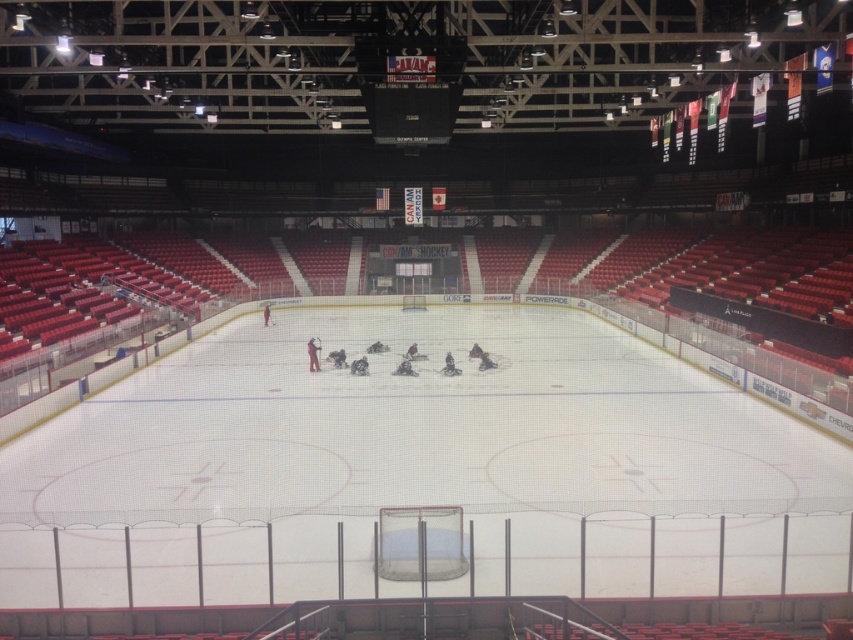
You are standing at the edge of the indoor ice hockey rink and want to move towards the two points marked on the ice. The first point is labeled as point (310, 369) and the second is point (396, 368). Which point should you head towards if you want to reach the one that is closer to you first?

You should head towards point (310, 369) because it is closer to the viewer than point (396, 368).

You are a photographer standing at the edge of the ice hockey rink. You want to take a photo that includes both the dark blue jersey at center and the white matte hockey at center. Which object should you zoom in on to ensure both are clearly visible in the frame?

The dark blue jersey at center is smaller than the white matte hockey at center. To ensure both are clearly visible, you should zoom in on the smaller object, which is the dark blue jersey at center, so that the larger object, the white matte hockey at center, remains in frame without being too dominant.

You are standing at the entrance of the ice hockey rink and see the black matte hockey stick at center. If you want to retrieve it, which direction should you move towards?

The black matte hockey stick at center is located at point 0.553 on the x axis and 0.368 on the y axis. Since you are at the entrance, you should move towards the center of the rink to retrieve it.